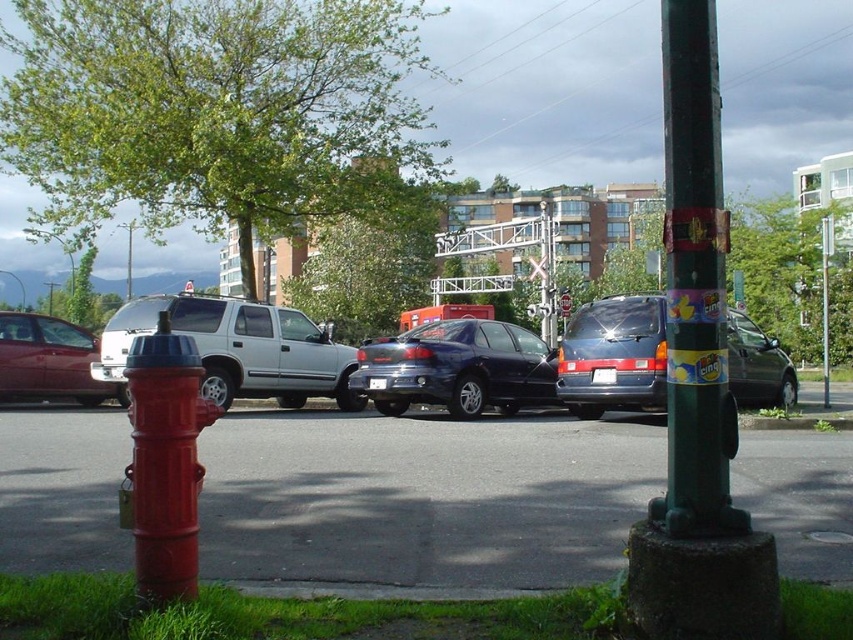
You are a delivery driver who needs to park your truck, which is 2 meters wide, in this parking lot. You see the matte black minivan at center and the brushed metal fire hydrant at lower left. Can you safely park your truck between them without hitting either?

The matte black minivan at center might be wider than the brushed metal fire hydrant at lower left, so there is uncertainty about the available space. If the minivan is indeed wider, the distance between them may be insufficient for a 2m wide truck. It is safer to avoid parking there unless the exact dimensions are confirmed.

You are a delivery person trying to park your 2.5 meters wide truck between the green matte pole at right and the shiny black sedan at center. Can your truck fit in the space between them?

The green matte pole at right has a lesser width compared to shiny black sedan at center. However, the width of the pole and sedan alone doesn not provide enough information to determine if the space between them is wide enough for a 2.5 meters wide truck. The actual distance between the two objects must be considered, which is not specified in the given description.